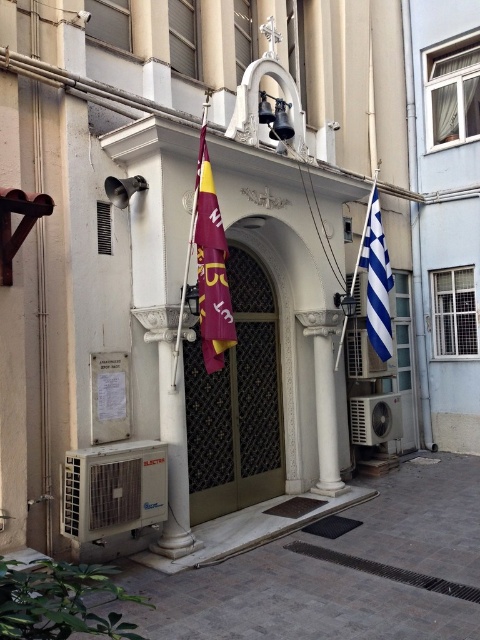
Question: Is gold metallic door at center above maroon fabric flag at center?

Choices:
 (A) yes
 (B) no

Answer: (B)

Question: Which object appears farthest from the camera in this image?

Choices:
 (A) maroon fabric flag at center
 (B) blue and white striped flag at right

Answer: (B)

Question: Is maroon fabric flag at center bigger than blue and white striped flag at right?

Choices:
 (A) yes
 (B) no

Answer: (B)

Question: Based on their relative distances, which object is nearer to the blue and white striped flag at right?

Choices:
 (A) maroon fabric flag at center
 (B) gold metallic door at center

Answer: (B)

Question: Does gold metallic door at center have a greater width compared to maroon fabric flag at center?

Choices:
 (A) yes
 (B) no

Answer: (A)

Question: Which point is farther from the camera taking this photo?

Choices:
 (A) (365, 244)
 (B) (223, 323)

Answer: (A)